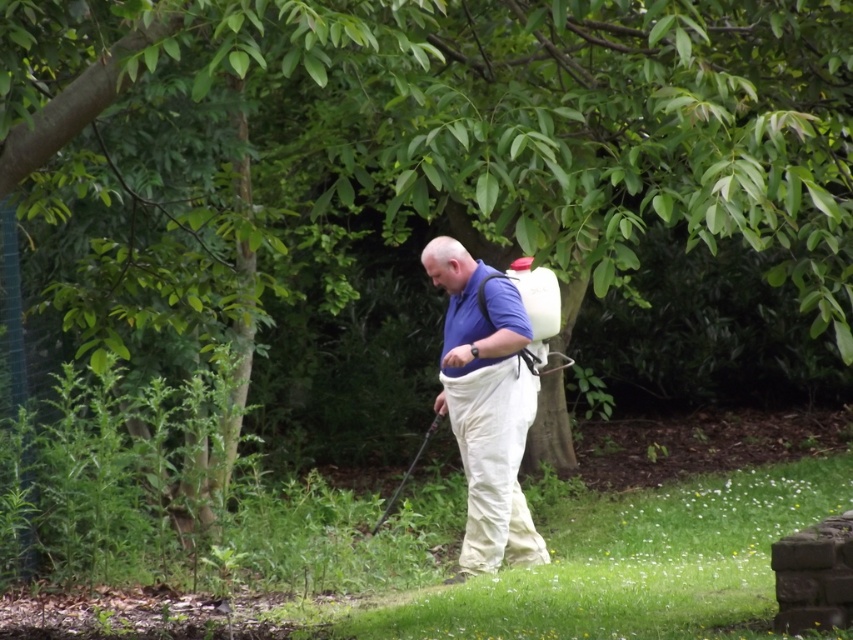
Does green grass at lower center appear on the left side of blue fabric shirt at center?

No, green grass at lower center is not to the left of blue fabric shirt at center.

Is green grass at lower center further to the viewer compared to blue fabric shirt at center?

That is True.

Who is more distant from viewer, [553,561] or [485,477]?

Positioned behind is point [553,561].

Where is `green grass at lower center`? This screenshot has height=640, width=853. green grass at lower center is located at coordinates (636, 564).